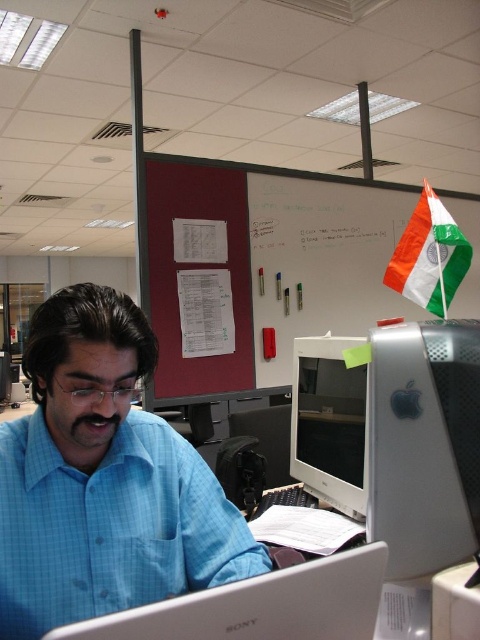
You are a tailor who needs to determine if a new button can be sewn onto the blue checkered shirt at center without overlapping the satin silver monitor at right. Given that the monitor is positioned to the right of the shirt, can the button be placed on the shirt without interfering with the monitor?

The blue checkered shirt at center is wider than the satin silver monitor at right, so the button can be placed on the shirt without overlapping the monitor as long as it is positioned within the shirt area.

You are organizing cables for the workstation. You need to connect a new cable from the matte blue laptop at lower center to the satin silver monitor at right. Based on their positions, which direction should you route the cable from the laptop to reach the monitor?

The satin silver monitor at right is positioned on the right side of the matte blue laptop at lower center, so you should route the cable from the matte blue laptop at lower center to the right to reach the satin silver monitor at right.